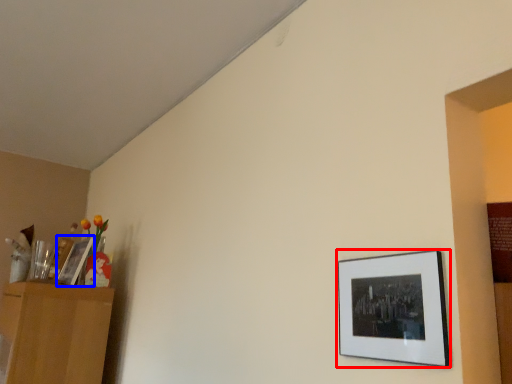
Question: Among these objects, which one is farthest to the camera, picture frame (highlighted by a red box) or picture frame (highlighted by a blue box)?

Choices:
 (A) picture frame
 (B) picture frame

Answer: (B)